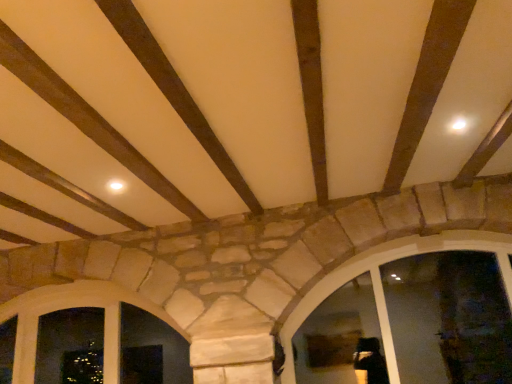
Question: Considering their positions, is natural stone window at lower left, positioned as the 1th window in left-to-right order, located in front of or behind natural stone window at center, which is the second window from left to right?

Choices:
 (A) behind
 (B) front

Answer: (A)

Question: From the image's perspective, is natural stone window at lower left, the 2th window when ordered from right to left, located above or below natural stone window at center, which is the second window from left to right?

Choices:
 (A) below
 (B) above

Answer: (A)

Question: Is natural stone window at lower left, positioned as the 1th window in left-to-right order, wider or thinner than natural stone window at center, which is the second window from left to right?

Choices:
 (A) wide
 (B) thin

Answer: (B)

Question: Considering the positions of natural stone window at center, placed as the first window when sorted from right to left, and natural stone window at lower left, positioned as the 1th window in left-to-right order, in the image, is natural stone window at center, placed as the first window when sorted from right to left, taller or shorter than natural stone window at lower left, positioned as the 1th window in left-to-right order,?

Choices:
 (A) short
 (B) tall

Answer: (B)

Question: Would you say natural stone window at center, which is the second window from left to right, is inside or outside natural stone window at lower left, the 2th window when ordered from right to left?

Choices:
 (A) outside
 (B) inside

Answer: (A)

Question: From the image's perspective, is natural stone window at center, which is the second window from left to right, located above or below natural stone window at lower left, positioned as the 1th window in left-to-right order?

Choices:
 (A) above
 (B) below

Answer: (A)

Question: Visually, is natural stone window at center, placed as the first window when sorted from right to left, positioned to the left or to the right of natural stone window at lower left, the 2th window when ordered from right to left?

Choices:
 (A) left
 (B) right

Answer: (B)